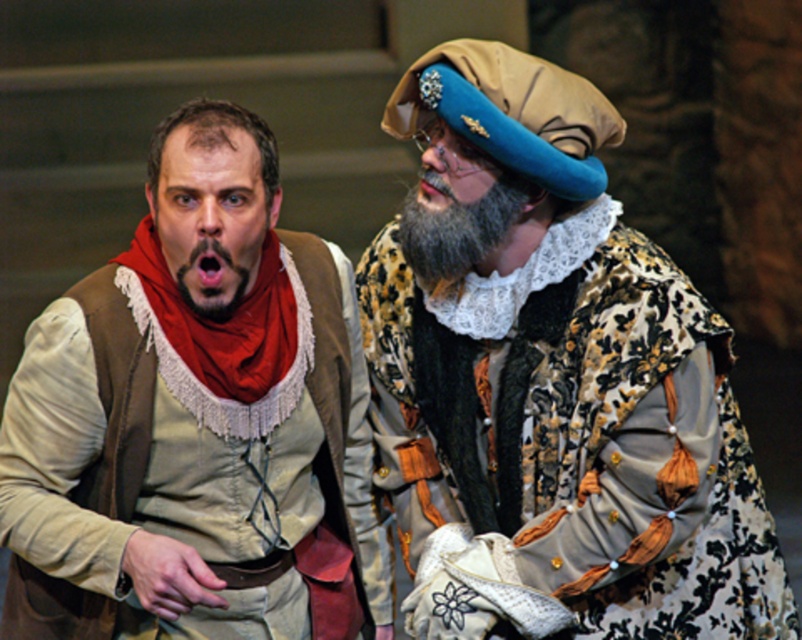
Can you confirm if matte brown vest at left is thinner than dark brown fuzzy beard at left?

No, matte brown vest at left is not thinner than dark brown fuzzy beard at left.

Does matte brown vest at left come behind dark brown fuzzy beard at left?

No, it is in front of dark brown fuzzy beard at left.

Which is in front, point (134, 515) or point (211, 266)?

Point (211, 266) is more forward.

Image resolution: width=802 pixels, height=640 pixels. Identify the location of matte brown vest at left. (196, 428).

Can you confirm if velvet floral robe at center is positioned to the right of gray fuzzy beard at center?

Indeed, velvet floral robe at center is positioned on the right side of gray fuzzy beard at center.

Can you confirm if velvet floral robe at center is wider than gray fuzzy beard at center?

Indeed, velvet floral robe at center has a greater width compared to gray fuzzy beard at center.

Does point (638, 340) come farther from viewer compared to point (406, 196)?

No, it is in front of (406, 196).

Find the location of `velvet floral robe at center`. velvet floral robe at center is located at coordinates (551, 381).

Does matte brown vest at left lie behind gray fuzzy beard at center?

No, it is not.

Does matte brown vest at left have a greater width compared to gray fuzzy beard at center?

Correct, the width of matte brown vest at left exceeds that of gray fuzzy beard at center.

Who is more distant from viewer, (99, 436) or (500, 209)?

The point (500, 209) is behind.

Locate an element on the screen. The width and height of the screenshot is (802, 640). matte brown vest at left is located at coordinates (196, 428).